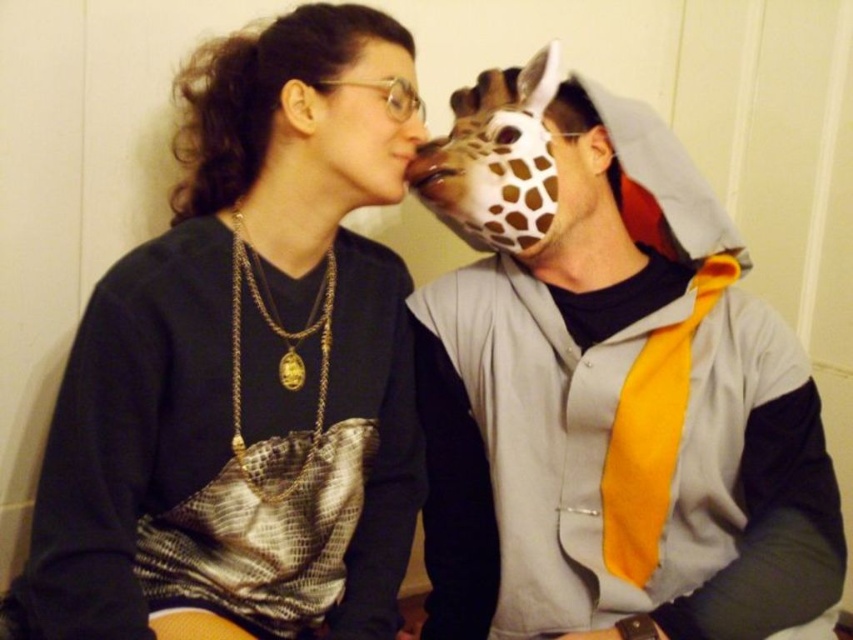
Who is positioned more to the right, matte gray hoodie at center or matte black face at upper left?

From the viewer's perspective, matte gray hoodie at center appears more on the right side.

Is matte gray hoodie at center bigger than matte black face at upper left?

Correct, matte gray hoodie at center is larger in size than matte black face at upper left.

Is point (556, 259) closer to camera compared to point (399, 77)?

No, it is not.

The height and width of the screenshot is (640, 853). Find the location of `matte gray hoodie at center`. matte gray hoodie at center is located at coordinates (607, 388).

Is matte gray hoodie at center taller than matte black sweater at upper left?

Yes.

Does matte gray hoodie at center have a larger size compared to matte black sweater at upper left?

Incorrect, matte gray hoodie at center is not larger than matte black sweater at upper left.

Who is more forward, (672, 577) or (306, 45)?

Positioned in front is point (306, 45).

I want to click on matte gray hoodie at center, so click(607, 388).

Which is behind, point (213, 602) or point (351, 65)?

Positioned behind is point (351, 65).

Is matte black sweater at upper left to the left of matte black face at upper left from the viewer's perspective?

Indeed, matte black sweater at upper left is positioned on the left side of matte black face at upper left.

Does point (415, 467) come farther from viewer compared to point (315, 115)?

Yes, point (415, 467) is behind point (315, 115).

Identify the location of matte black sweater at upper left. The width and height of the screenshot is (853, 640). pos(247,364).